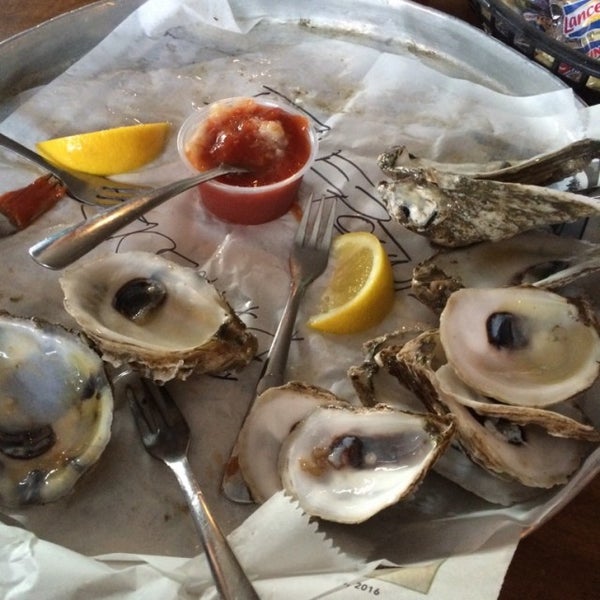
If there are any what looks like tissue paper present in the image, indicate their positions. Your answer should be formatted as a list of tuples, i.e. [(x1, y1), (x2, y2), ...], where each tuple contains the x and y coordinates of a point satisfying the conditions above.

[(308, 541)]